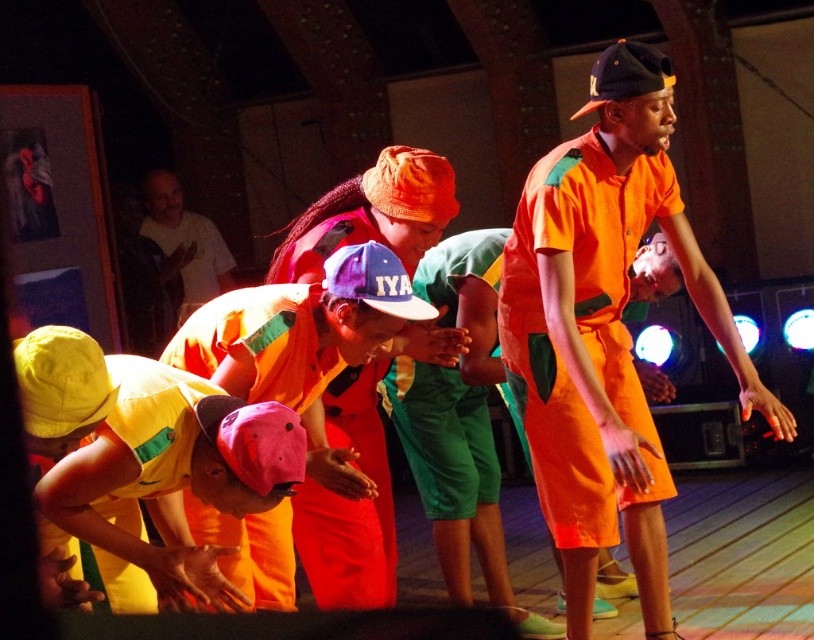
Which of these two, orange cotton jumpsuit at center or yellow fabric cap at lower left, stands taller?

With more height is orange cotton jumpsuit at center.

Does orange cotton jumpsuit at center have a greater width compared to yellow fabric cap at lower left?

Result: Yes, orange cotton jumpsuit at center is wider than yellow fabric cap at lower left.

The height and width of the screenshot is (640, 814). Describe the element at coordinates (605, 330) in the screenshot. I see `orange cotton jumpsuit at center` at that location.

Locate an element on the screen. This screenshot has width=814, height=640. orange cotton jumpsuit at center is located at coordinates (605, 330).

Who is taller, orange fabric cap at center or white t-shirt at upper left?

white t-shirt at upper left is taller.

In the scene shown: Does orange fabric cap at center appear on the right side of white t-shirt at upper left?

Yes, orange fabric cap at center is to the right of white t-shirt at upper left.

Locate an element on the screen. Image resolution: width=814 pixels, height=640 pixels. orange fabric cap at center is located at coordinates (349, 502).

Locate an element on the screen. This screenshot has width=814, height=640. orange fabric cap at center is located at coordinates coord(349,502).

Can you confirm if yellow fabric cap at lower left is wider than white t-shirt at upper left?

No, yellow fabric cap at lower left is not wider than white t-shirt at upper left.

Locate an element on the screen. The image size is (814, 640). yellow fabric cap at lower left is located at coordinates pos(149,454).

This screenshot has width=814, height=640. Identify the location of yellow fabric cap at lower left. (149, 454).